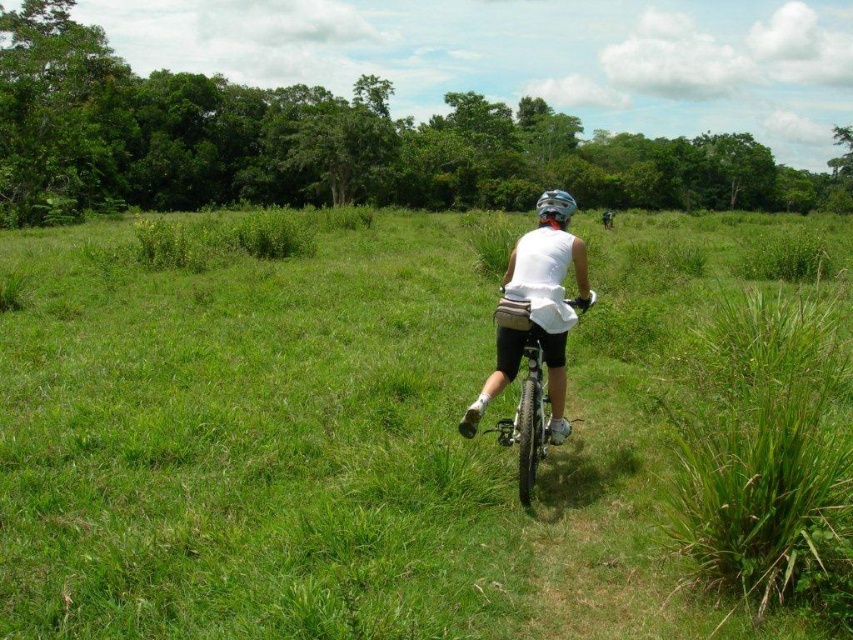
Can you confirm if matte black bicycle at center is bigger than matte black helmet at center?

No.

Is matte black bicycle at center taller than matte black helmet at center?

No.

Does point (537, 353) come farther from viewer compared to point (541, 211)?

No, it is in front of (541, 211).

The width and height of the screenshot is (853, 640). What are the coordinates of `matte black bicycle at center` in the screenshot? It's located at (525, 397).

Does matte black helmet at center appear under white matte helmet at center?

Yes.

Is point (541, 198) less distant than point (611, 220)?

Yes, point (541, 198) is closer to viewer.

This screenshot has height=640, width=853. I want to click on matte black helmet at center, so coord(555,205).

Find the location of a particular element. The height and width of the screenshot is (640, 853). matte black helmet at center is located at coordinates (555, 205).

Can you confirm if green grassy at center is positioned to the right of matte black bicycle at center?

Yes, green grassy at center is to the right of matte black bicycle at center.

Find the location of a particular element. The height and width of the screenshot is (640, 853). green grassy at center is located at coordinates (339, 436).

Identify the location of green grassy at center. The image size is (853, 640). (339, 436).